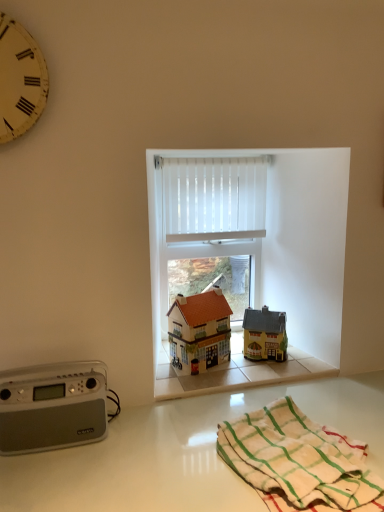
Locate an element on the screen. vacant area that is in front of gray plastic stereo at lower left is located at coordinates (54, 477).